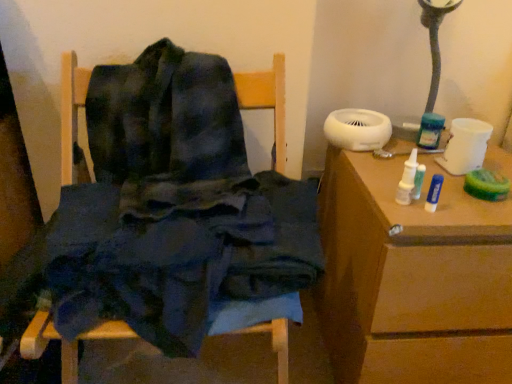
Question: Would you say dark blue fabric at center contains brown wooden table at right?

Choices:
 (A) yes
 (B) no

Answer: (B)

Question: Does dark blue fabric at center appear on the left side of brown wooden table at right?

Choices:
 (A) no
 (B) yes

Answer: (B)

Question: Considering the relative sizes of dark blue fabric at center and brown wooden table at right in the image provided, is dark blue fabric at center wider than brown wooden table at right?

Choices:
 (A) yes
 (B) no

Answer: (B)

Question: Is dark blue fabric at center shorter than brown wooden table at right?

Choices:
 (A) no
 (B) yes

Answer: (A)

Question: Is dark blue fabric at center positioned with its back to brown wooden table at right?

Choices:
 (A) no
 (B) yes

Answer: (A)

Question: Can you confirm if dark blue fabric at center is smaller than brown wooden table at right?

Choices:
 (A) yes
 (B) no

Answer: (B)

Question: Is brown wooden table at right not within dark blue fabric at center?

Choices:
 (A) yes
 (B) no

Answer: (A)

Question: From the image's perspective, is brown wooden table at right beneath dark blue fabric at center?

Choices:
 (A) yes
 (B) no

Answer: (A)

Question: From a real-world perspective, is brown wooden table at right positioned under dark blue fabric at center based on gravity?

Choices:
 (A) yes
 (B) no

Answer: (A)

Question: Is brown wooden table at right not close to dark blue fabric at center?

Choices:
 (A) no
 (B) yes

Answer: (A)

Question: From the image's perspective, is brown wooden table at right on dark blue fabric at center?

Choices:
 (A) no
 (B) yes

Answer: (A)

Question: Does brown wooden table at right appear on the left side of dark blue fabric at center?

Choices:
 (A) yes
 (B) no

Answer: (B)

Question: In terms of width, does dark blue fabric at center look wider or thinner when compared to brown wooden table at right?

Choices:
 (A) wide
 (B) thin

Answer: (B)